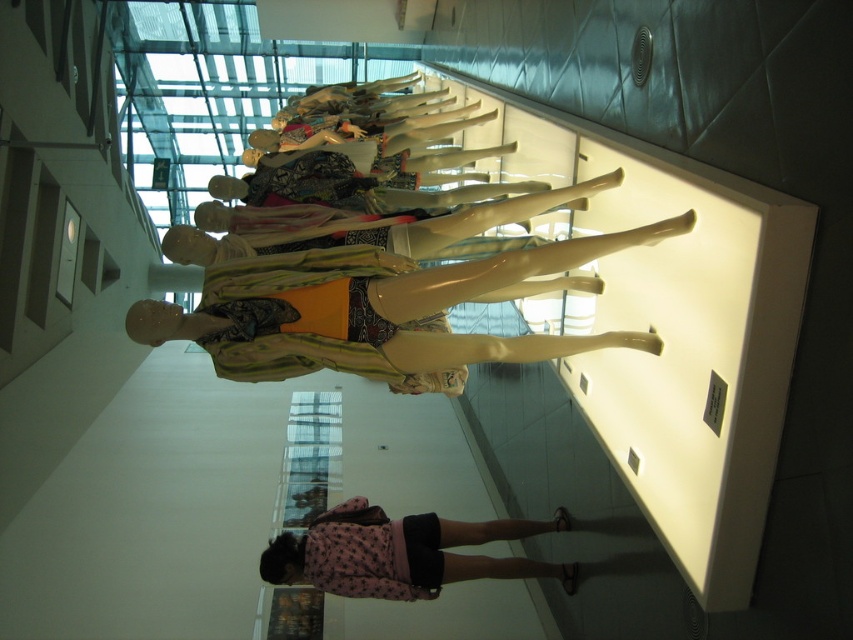
Does matte yellow mannequin at center appear over pink fabric dress at lower center?

Yes, matte yellow mannequin at center is above pink fabric dress at lower center.

Which is below, matte yellow mannequin at center or pink fabric dress at lower center?

pink fabric dress at lower center is lower down.

Which is in front, point (329, 104) or point (347, 596)?

Point (347, 596)

Identify the location of matte yellow mannequin at center. Image resolution: width=853 pixels, height=640 pixels. (373, 280).